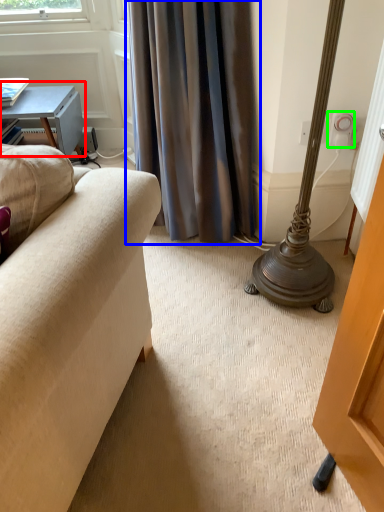
Question: Which object is the closest to the table (highlighted by a red box)? Choose among these: curtain (highlighted by a blue box) or electric outlet (highlighted by a green box).

Choices:
 (A) curtain
 (B) electric outlet

Answer: (A)